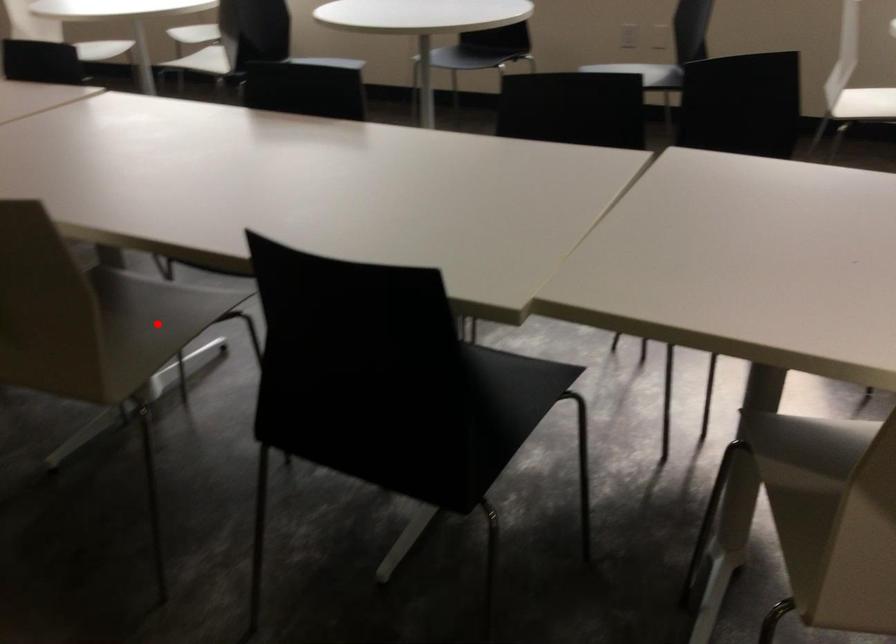
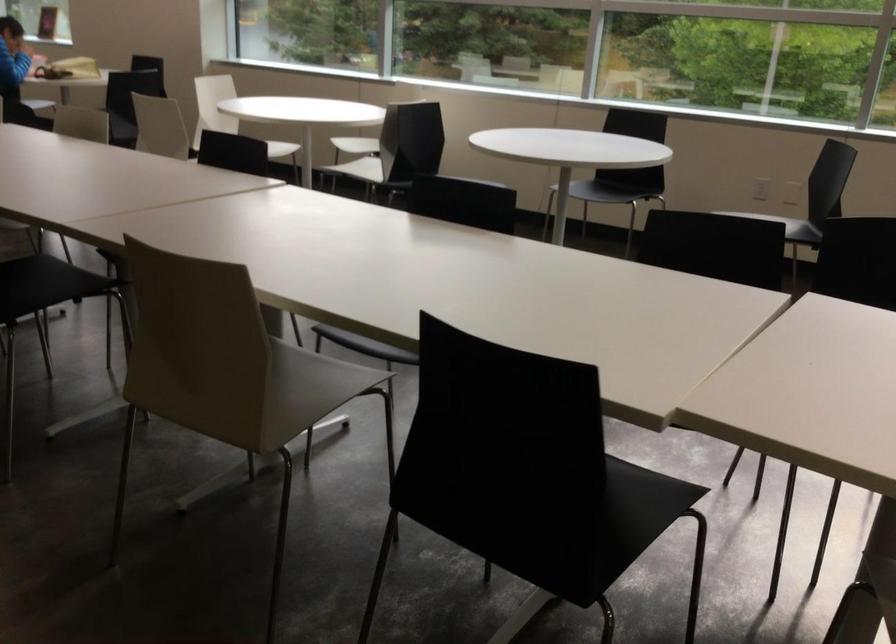
Find the pixel in the second image that matches the highlighted location in the first image.

(306, 390)